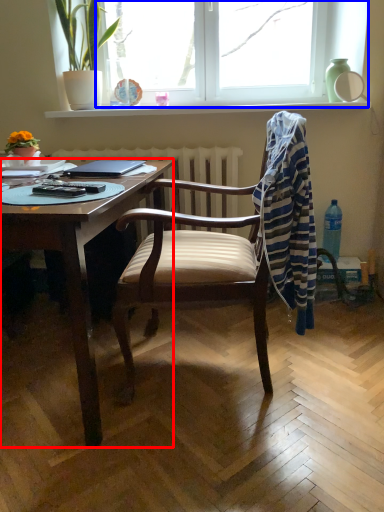
Question: Among these objects, which one is farthest to the camera, desk (highlighted by a red box) or window (highlighted by a blue box)?

Choices:
 (A) desk
 (B) window

Answer: (B)